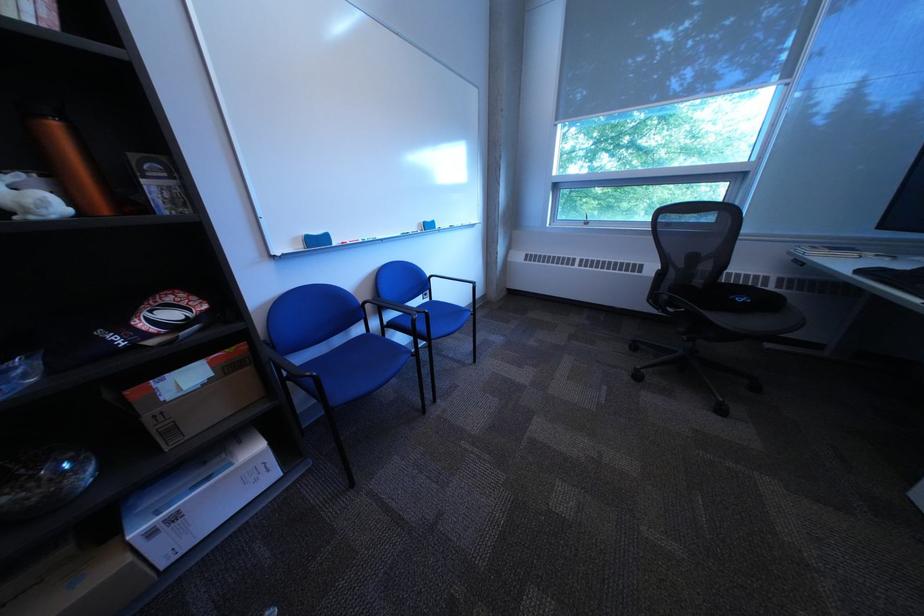
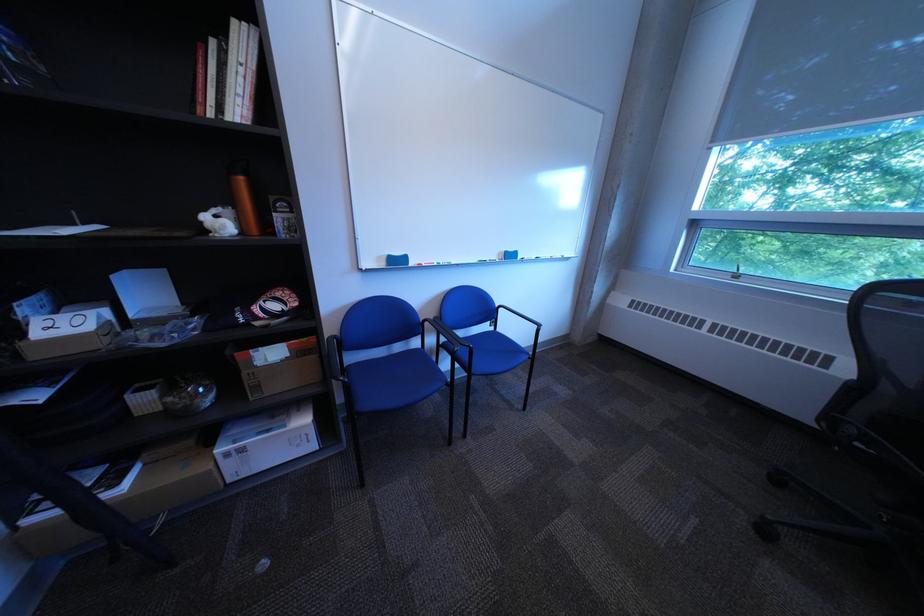
Based on the photo, what movement of the cameraman would produce the second image?

The cameraman moved toward right, forward.